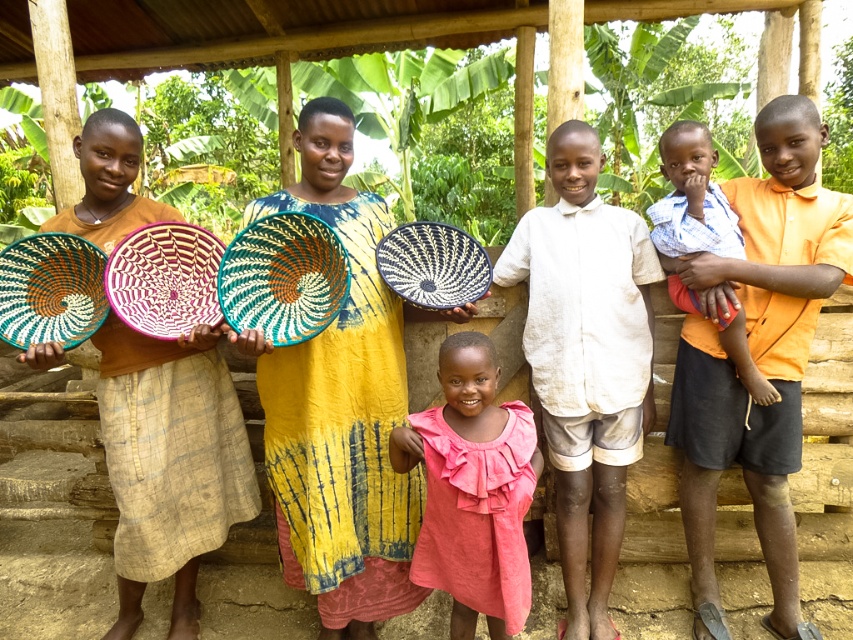
You are a photographer trying to capture the white cotton shirt at center and the black woven basket at center in the same frame. Which object should you focus on first to ensure both are in focus?

The white cotton shirt at center is positioned under the black woven basket at center, so you should focus on the black woven basket at center first to ensure both are in focus.

You are a photographer trying to capture a clear shot of the white cotton shirt at center and the black woven basket at center. The camera you are using has a depth of field that can focus on objects within a 24 inch range. Will both items be in focus at the same time?

The white cotton shirt at center and black woven basket at center are 24.78 inches apart, which exceeds the camera depth of field range of 24 inches. Therefore, both items cannot be in focus simultaneously.